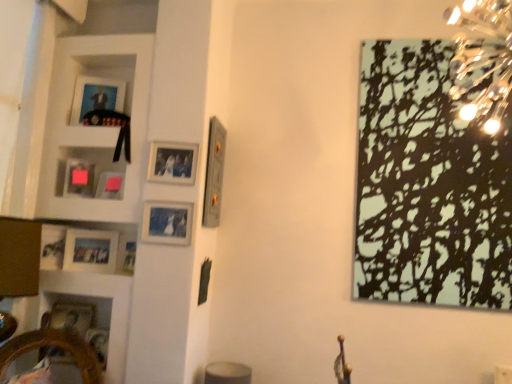
Measure the distance between point (135,248) and camera.

They are 2.23 meters apart.

What is the approximate width of matte silver picture frame at left, marked as the 6th picture frame in a left-to-right arrangement?

The width of matte silver picture frame at left, marked as the 6th picture frame in a left-to-right arrangement, is 2.73 inches.

This screenshot has height=384, width=512. What do you see at coordinates (96, 96) in the screenshot?
I see `matte black picture frame at upper left, which appears as the 8th picture frame when viewed from the right` at bounding box center [96, 96].

Describe the element at coordinates (167, 223) in the screenshot. The height and width of the screenshot is (384, 512). I see `matte glass picture frame at center-left, the seventh picture frame when ordered from left to right` at that location.

Where is `wooden photo frame at lower left, the 10th picture frame in the right-to-left sequence`? wooden photo frame at lower left, the 10th picture frame in the right-to-left sequence is located at coordinates (72, 317).

From the picture: In order to face wooden mirror at lower left, should I rotate leftwards or rightwards?

Turn left by 28.579 degrees to look at wooden mirror at lower left.

In order to click on black matte picture frame at upper right, arranged as the 10th picture frame when viewed from the left in this screenshot , I will do `click(428, 186)`.

In terms of height, does wooden mirror at lower left look taller or shorter compared to matte glass picture frame at center-left, which appears as the fourth picture frame when viewed from the right?

wooden mirror at lower left is shorter than matte glass picture frame at center-left, which appears as the fourth picture frame when viewed from the right.

Which object is closer to the camera taking this photo, wooden mirror at lower left or matte glass picture frame at center-left, the seventh picture frame when ordered from left to right?

wooden mirror at lower left.

From a real-world perspective, who is located lower, wooden mirror at lower left or matte glass picture frame at center-left, the seventh picture frame when ordered from left to right?

In real-world perspective, wooden mirror at lower left is lower.

How much distance is there between wooden mirror at lower left and matte glass picture frame at center-left, the seventh picture frame when ordered from left to right?

wooden mirror at lower left is 28.84 inches away from matte glass picture frame at center-left, the seventh picture frame when ordered from left to right.

Looking at their sizes, would you say matte black picture frame at upper left, which is the 3th picture frame from left to right, is wider or thinner than matte silver picture frame at upper center, positioned as the third picture frame in right-to-left order?

Considering their sizes, matte black picture frame at upper left, which is the 3th picture frame from left to right, looks broader than matte silver picture frame at upper center, positioned as the third picture frame in right-to-left order.

Can we say matte black picture frame at upper left, which is the 3th picture frame from left to right, lies outside matte silver picture frame at upper center, the eighth picture frame positioned from the left?

That's correct, matte black picture frame at upper left, which is the 3th picture frame from left to right, is outside of matte silver picture frame at upper center, the eighth picture frame positioned from the left.

Between point (122, 97) and point (166, 150), which one is positioned in front?

Point (166, 150)

From the image's perspective, which one is positioned lower, matte black picture frame at upper left, which is the 3th picture frame from left to right, or matte silver picture frame at upper center, the eighth picture frame positioned from the left?

matte silver picture frame at upper center, the eighth picture frame positioned from the left.

Between wooden photo frame at lower left, the 10th picture frame in the right-to-left sequence, and matte plastic picture frame at upper left, the sixth picture frame from the right, which one has larger size?

wooden photo frame at lower left, the 10th picture frame in the right-to-left sequence.

Is wooden photo frame at lower left, the 10th picture frame in the right-to-left sequence, wider or thinner than matte plastic picture frame at upper left, the sixth picture frame from the right?

wooden photo frame at lower left, the 10th picture frame in the right-to-left sequence, is wider than matte plastic picture frame at upper left, the sixth picture frame from the right.

Which of these two, wooden photo frame at lower left, which is counted as the first picture frame, starting from the left, or matte plastic picture frame at upper left, the 5th picture frame viewed from the left, stands shorter?

matte plastic picture frame at upper left, the 5th picture frame viewed from the left, is shorter.

Would you say matte pink picture frame at upper left, which is the second picture frame from left to right, contains matte silver picture frame at left, the fifth picture frame viewed from the right?

Actually, matte silver picture frame at left, the fifth picture frame viewed from the right, is outside matte pink picture frame at upper left, which is the second picture frame from left to right.

How many degrees apart are the facing directions of matte pink picture frame at upper left, arranged as the ninth picture frame when viewed from the right, and matte silver picture frame at left, the fifth picture frame viewed from the right?

The facing directions of matte pink picture frame at upper left, arranged as the ninth picture frame when viewed from the right, and matte silver picture frame at left, the fifth picture frame viewed from the right, are 35.2 degrees apart.

Which is in front, matte pink picture frame at upper left, which is the second picture frame from left to right, or matte silver picture frame at left, marked as the 6th picture frame in a left-to-right arrangement?

matte pink picture frame at upper left, which is the second picture frame from left to right, is closer to the camera.

Which object is positioned more to the right, matte pink picture frame at upper left, which is the second picture frame from left to right, or matte silver picture frame at left, the fifth picture frame viewed from the right?

matte silver picture frame at left, the fifth picture frame viewed from the right.

Is white glossy cabinet at upper left directly adjacent to matte pink picture frame at upper left, arranged as the ninth picture frame when viewed from the right?

No.

Where is `picture frame that is the 4th object located behind the white glossy cabinet at upper left`? The height and width of the screenshot is (384, 512). picture frame that is the 4th object located behind the white glossy cabinet at upper left is located at coordinates (79, 179).

Can you confirm if white glossy cabinet at upper left is positioned to the right of matte pink picture frame at upper left, which is the second picture frame from left to right?

Indeed, white glossy cabinet at upper left is positioned on the right side of matte pink picture frame at upper left, which is the second picture frame from left to right.

From a real-world perspective, is white glossy cabinet at upper left above or below matte pink picture frame at upper left, which is the second picture frame from left to right?

In terms of real-world spatial position, white glossy cabinet at upper left is above matte pink picture frame at upper left, which is the second picture frame from left to right.

Considering the positions of objects wooden photo frame at lower left, which is counted as the first picture frame, starting from the left, and matte black picture frame at upper left, which is the 3th picture frame from left to right, in the image provided, who is more to the left, wooden photo frame at lower left, which is counted as the first picture frame, starting from the left, or matte black picture frame at upper left, which is the 3th picture frame from left to right,?

wooden photo frame at lower left, which is counted as the first picture frame, starting from the left.

From the image's perspective, count 9th picture frames upward from the wooden photo frame at lower left, the 10th picture frame in the right-to-left sequence, and point to it. Please provide its 2D coordinates.

[(96, 96)]

How distant is wooden photo frame at lower left, which is counted as the first picture frame, starting from the left, from matte black picture frame at upper left, which appears as the 8th picture frame when viewed from the right?

They are 1.17 meters apart.

Could you tell me if wooden photo frame at lower left, which is counted as the first picture frame, starting from the left, is turned towards matte black picture frame at upper left, which is the 3th picture frame from left to right?

No, wooden photo frame at lower left, which is counted as the first picture frame, starting from the left, is not turned towards matte black picture frame at upper left, which is the 3th picture frame from left to right.

I want to click on picture frame that is the 7th object directly below the matte silver picture frame at upper center, the eighth picture frame positioned from the left (from a real-world perspective), so click(x=72, y=317).

How different are the orientations of wooden photo frame at lower left, the 10th picture frame in the right-to-left sequence, and matte silver picture frame at upper center, the eighth picture frame positioned from the left, in degrees?

17.3 degrees separate the facing orientations of wooden photo frame at lower left, the 10th picture frame in the right-to-left sequence, and matte silver picture frame at upper center, the eighth picture frame positioned from the left.

Between point (61, 304) and point (185, 184), which one is positioned in front?

The point (185, 184) is in front.

Would you say wooden photo frame at lower left, the 10th picture frame in the right-to-left sequence, contains matte silver picture frame at upper center, the eighth picture frame positioned from the left?

No, matte silver picture frame at upper center, the eighth picture frame positioned from the left, is located outside of wooden photo frame at lower left, the 10th picture frame in the right-to-left sequence.

Find the location of a particular element. mirror on the left side of matte glass picture frame at center-left, the seventh picture frame when ordered from left to right is located at coordinates (55, 345).

There is a matte silver picture frame at upper center, the eighth picture frame positioned from the left. Where is `the 2nd picture frame above it (from a real-world perspective)`? Image resolution: width=512 pixels, height=384 pixels. the 2nd picture frame above it (from a real-world perspective) is located at coordinates (96, 96).

When comparing their distances from matte wooden picture frame at left, the seventh picture frame in the right-to-left sequence, does matte glass picture frame at center-left, which appears as the fourth picture frame when viewed from the right, or wooden photo frame at lower left, the 10th picture frame in the right-to-left sequence, seem closer?

Among the two, wooden photo frame at lower left, the 10th picture frame in the right-to-left sequence, is located nearer to matte wooden picture frame at left, the seventh picture frame in the right-to-left sequence.

Which object lies further to the anchor point matte glass picture frame at center-left, which appears as the fourth picture frame when viewed from the right, matte black picture frame at upper left, which appears as the 8th picture frame when viewed from the right, or matte silver picture frame at left, the fifth picture frame viewed from the right?

The object further to matte glass picture frame at center-left, which appears as the fourth picture frame when viewed from the right, is matte black picture frame at upper left, which appears as the 8th picture frame when viewed from the right.

From the image, which object appears to be nearer to matte silver picture frame at upper center, positioned as the third picture frame in right-to-left order, matte silver picture frame at left, the fifth picture frame viewed from the right, or wooden photo frame at lower left, which is counted as the first picture frame, starting from the left?

Based on the image, matte silver picture frame at left, the fifth picture frame viewed from the right, appears to be nearer to matte silver picture frame at upper center, positioned as the third picture frame in right-to-left order.

Which object lies nearer to the anchor point matte plastic picture frame at upper left, the 5th picture frame viewed from the left, matte silver picture frame at upper center, the eighth picture frame positioned from the left, or matte glass picture frame at center-left, which appears as the fourth picture frame when viewed from the right?

matte silver picture frame at upper center, the eighth picture frame positioned from the left, is positioned closer to the anchor matte plastic picture frame at upper left, the 5th picture frame viewed from the left.

From the image, which object appears to be nearer to wooden photo frame at lower left, the 10th picture frame in the right-to-left sequence, matte silver picture frame at upper center, the eighth picture frame positioned from the left, or white glossy cabinet at upper left?

white glossy cabinet at upper left lies closer to wooden photo frame at lower left, the 10th picture frame in the right-to-left sequence, than the other object.

Estimate the real-world distances between objects in this image. Which object is closer to matte plastic picture frame at upper left, the sixth picture frame from the right, white glossy cabinet at upper left or metallic silver picture frame at center, placed as the 9th picture frame when sorted from left to right?

Based on the image, white glossy cabinet at upper left appears to be nearer to matte plastic picture frame at upper left, the sixth picture frame from the right.

Looking at the image, which one is located further to matte silver picture frame at upper center, the eighth picture frame positioned from the left, matte pink picture frame at upper left, which is the second picture frame from left to right, or matte glass picture frame at center-left, the seventh picture frame when ordered from left to right?

The object further to matte silver picture frame at upper center, the eighth picture frame positioned from the left, is matte pink picture frame at upper left, which is the second picture frame from left to right.

When comparing their distances from matte wooden picture frame at left, the seventh picture frame in the right-to-left sequence, does matte pink picture frame at upper left, arranged as the ninth picture frame when viewed from the right, or matte silver picture frame at upper center, positioned as the third picture frame in right-to-left order, seem further?

matte silver picture frame at upper center, positioned as the third picture frame in right-to-left order, is further to matte wooden picture frame at left, the seventh picture frame in the right-to-left sequence.

Locate an element on the screen. The image size is (512, 384). picture frame between matte silver picture frame at upper center, positioned as the third picture frame in right-to-left order, and black matte picture frame at upper right, arranged as the 10th picture frame when viewed from the left is located at coordinates (214, 173).

Where is `cabinet situated between matte pink picture frame at upper left, arranged as the ninth picture frame when viewed from the right, and matte glass picture frame at center-left, which appears as the fourth picture frame when viewed from the right, from left to right`? cabinet situated between matte pink picture frame at upper left, arranged as the ninth picture frame when viewed from the right, and matte glass picture frame at center-left, which appears as the fourth picture frame when viewed from the right, from left to right is located at coordinates (95, 127).

The image size is (512, 384). Identify the location of cabinet between matte black picture frame at upper left, which is the 3th picture frame from left to right, and matte pink picture frame at upper left, arranged as the ninth picture frame when viewed from the right, vertically. (95, 127).

Locate an element on the screen. The image size is (512, 384). cabinet between matte black picture frame at upper left, which is the 3th picture frame from left to right, and matte silver picture frame at left, marked as the 6th picture frame in a left-to-right arrangement, in the vertical direction is located at coordinates (95, 127).